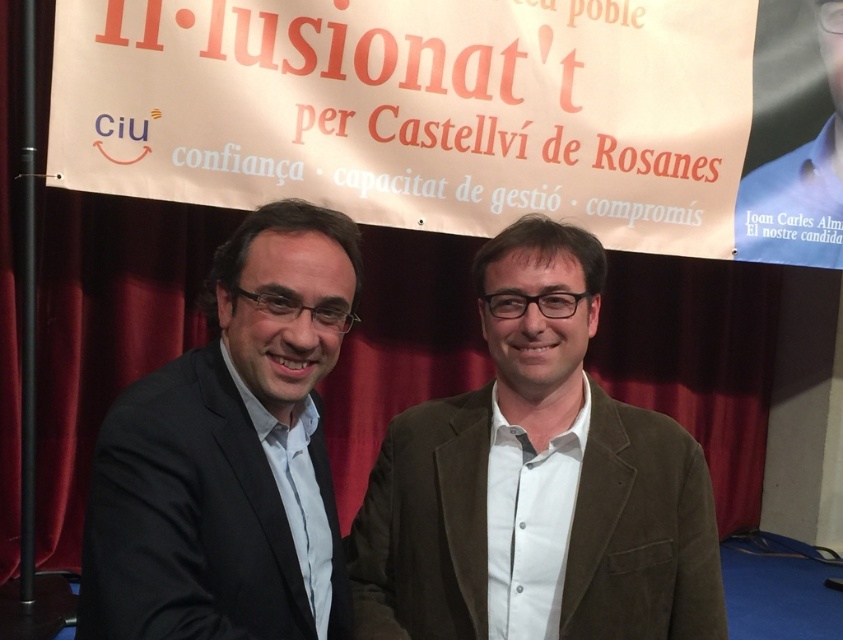
From the picture: You are a photographer who needs to place a microphone stand at point (535, 483). What object will the microphone stand be placed under?

The microphone stand will be placed under the suede brown blazer at center located at point (535, 483).

You are a photographer at a political event and need to adjust the lighting so that the tallest object between the suede brown blazer at center and the matte black suit at left is properly illuminated. Which object should you focus on?

The suede brown blazer at center is taller than the matte black suit at left, so you should focus the lighting on the suede brown blazer at center to ensure proper illumination.